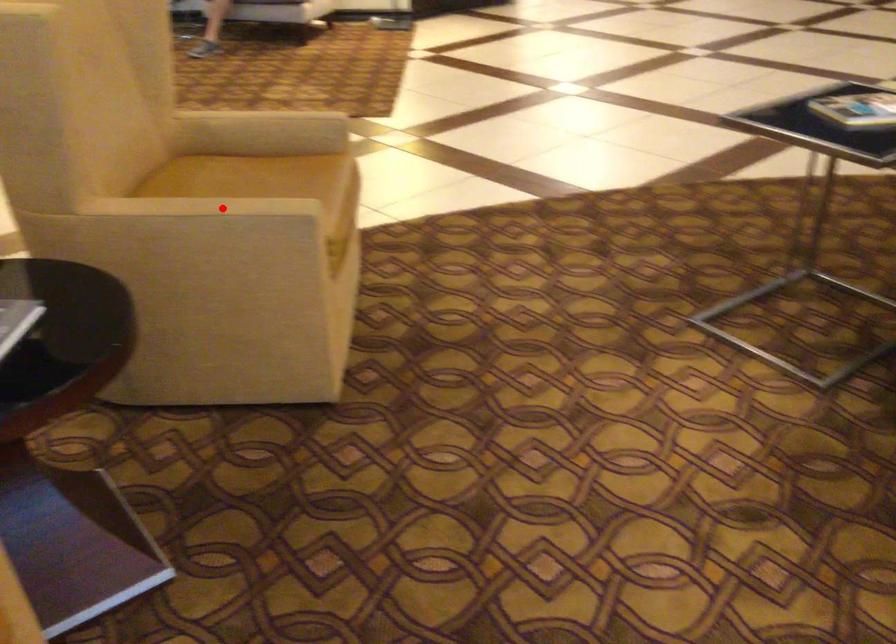
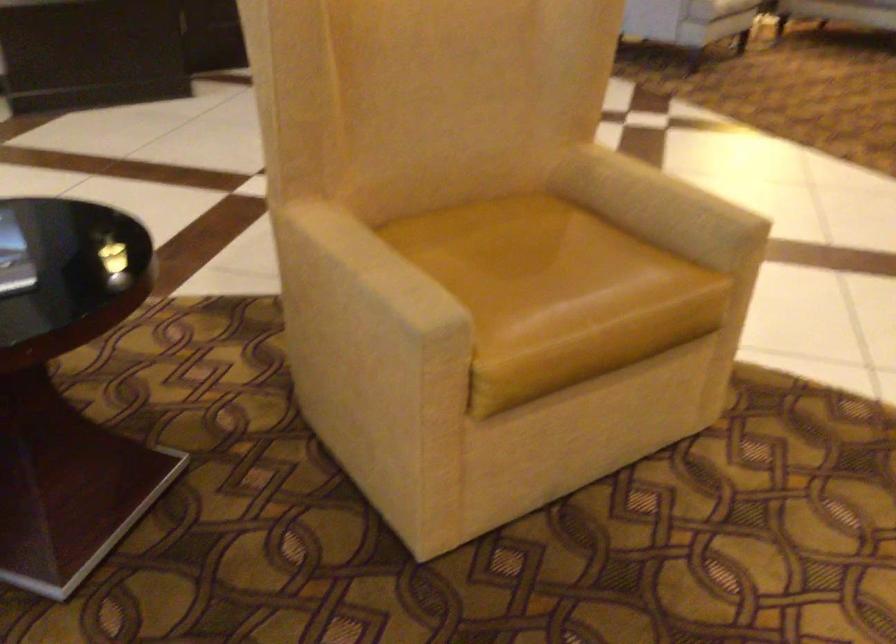
In the second image, find the point that corresponds to the highlighted location in the first image.

(375, 266)